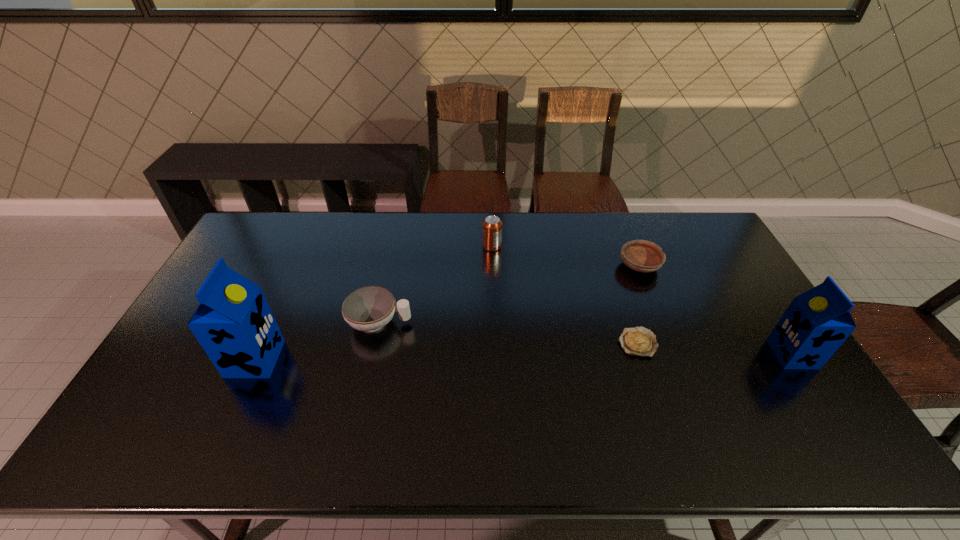
Find the location of a particular element. Image resolution: width=960 pixels, height=540 pixels. vacant spot for a new carton to ensure equal spacing is located at coordinates (525, 356).